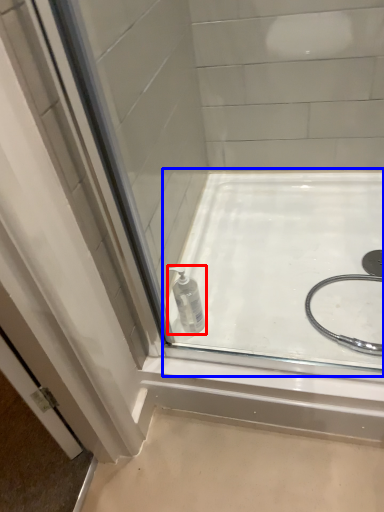
Question: Which of the following is the closest to the observer, bottle (highlighted by a red box) or bath (highlighted by a blue box)?

Choices:
 (A) bottle
 (B) bath

Answer: (B)